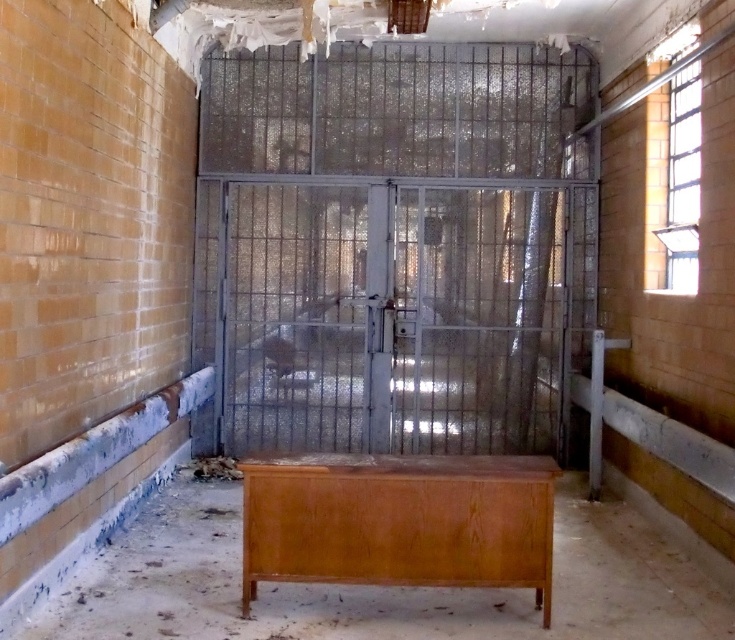
Question: Is metallic wire cage at center below wooden cabinet at center?

Choices:
 (A) no
 (B) yes

Answer: (A)

Question: Does metallic wire cage at center have a lesser width compared to wooden cabinet at center?

Choices:
 (A) no
 (B) yes

Answer: (A)

Question: Does metallic wire cage at center lie in front of wooden cabinet at center?

Choices:
 (A) no
 (B) yes

Answer: (A)